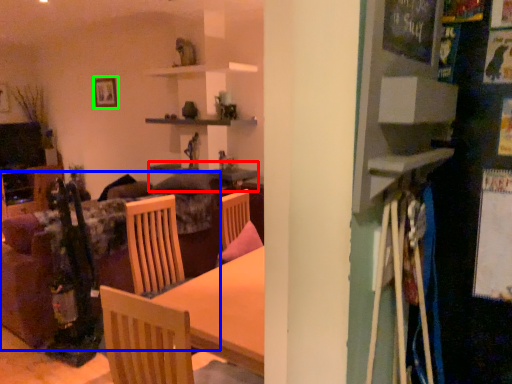
Question: Which object is the farthest from table (highlighted by a red box)? Choose among these: couch (highlighted by a blue box) or picture frame (highlighted by a green box).

Choices:
 (A) couch
 (B) picture frame

Answer: (A)